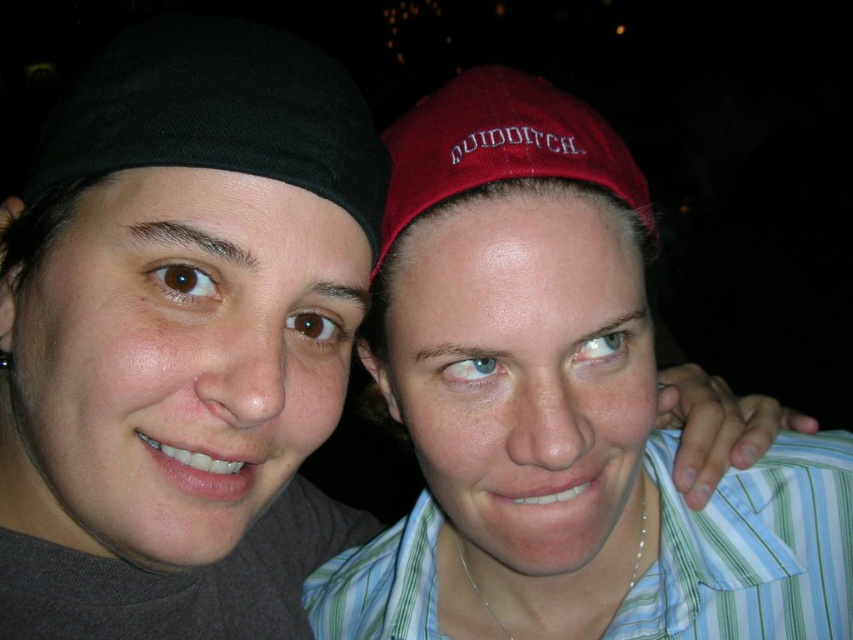
You are a photographer trying to capture a clear shot of both the black fabric headband at left and the burgundy fabric cap at upper center. Given that your camera has a depth of field that can focus on objects within a 5 cm range, will both items be in focus simultaneously?

The black fabric headband at left is 8.00 centimeters away from the burgundy fabric cap at upper center. Since the depth of field can only focus within a 5 cm range, the distance between them exceeds this limit, so both items cannot be in focus at the same time.

You are taking a photo of two people standing in front of you. The first person is at point (x=204, y=131) and the second is at point (x=434, y=99). Which person is closer to you?

The person at point (x=204, y=131) is closer to you because the point is closer to the camera than the other point.